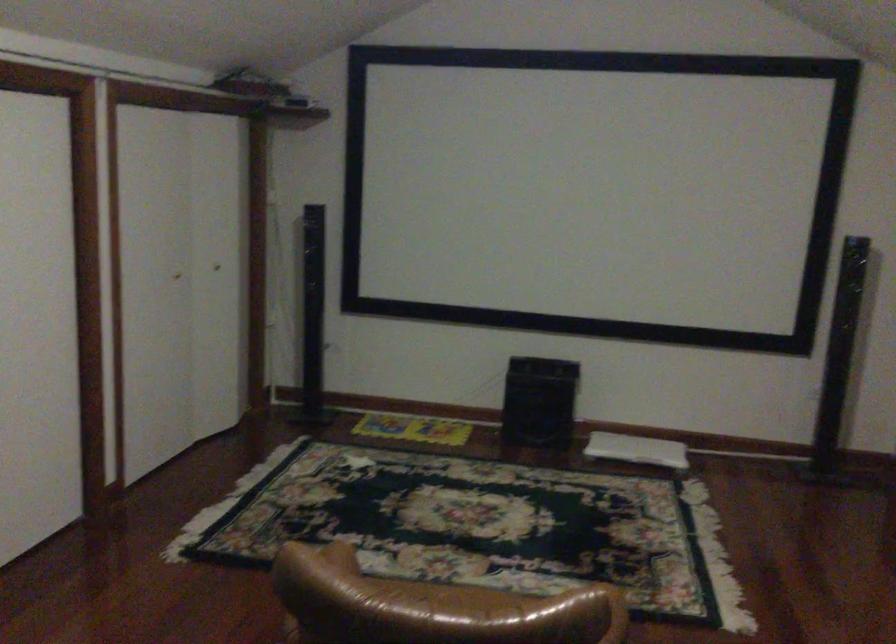
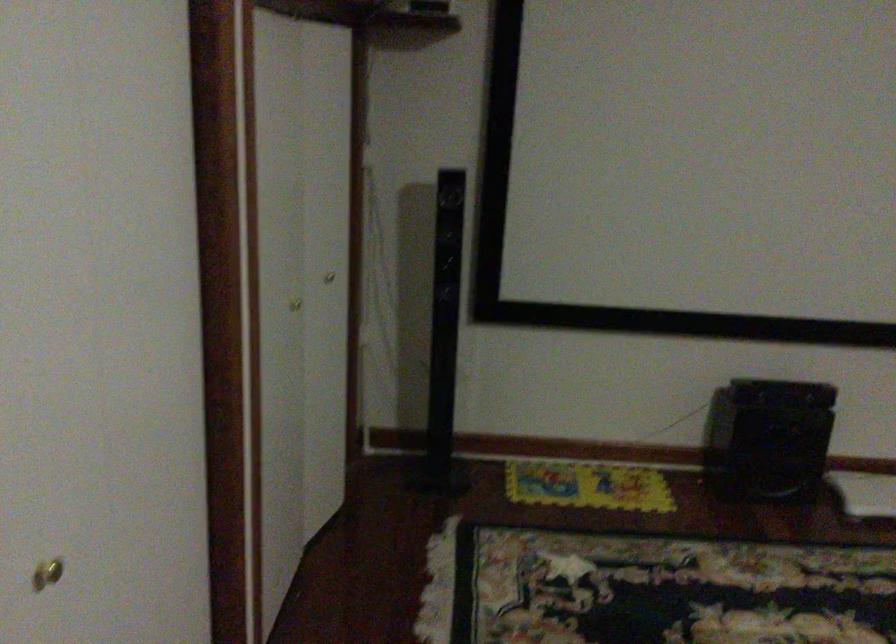
Which direction would the cameraman need to move to produce the second image?

The movement direction of the cameraman is left, forward.